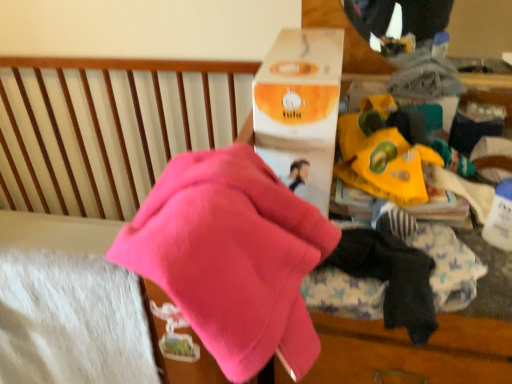
Question: From a real-world perspective, is dark blue cotton socks at lower right positioned under yellow paper bag at center based on gravity?

Choices:
 (A) no
 (B) yes

Answer: (B)

Question: Considering the relative sizes of dark blue cotton socks at lower right and yellow paper bag at center in the image provided, is dark blue cotton socks at lower right taller than yellow paper bag at center?

Choices:
 (A) yes
 (B) no

Answer: (A)

Question: Is yellow paper bag at center a part of dark blue cotton socks at lower right?

Choices:
 (A) yes
 (B) no

Answer: (B)

Question: Is dark blue cotton socks at lower right not inside yellow paper bag at center?

Choices:
 (A) yes
 (B) no

Answer: (A)

Question: From the image's perspective, is dark blue cotton socks at lower right beneath yellow paper bag at center?

Choices:
 (A) yes
 (B) no

Answer: (A)

Question: Is dark blue cotton socks at lower right positioned before yellow paper bag at center?

Choices:
 (A) no
 (B) yes

Answer: (B)

Question: Does pink fleece at center have a greater height compared to orange matte cardboard box at upper center?

Choices:
 (A) no
 (B) yes

Answer: (A)

Question: From a real-world perspective, is pink fleece at center over orange matte cardboard box at upper center?

Choices:
 (A) yes
 (B) no

Answer: (B)

Question: Can you confirm if pink fleece at center is positioned to the left of orange matte cardboard box at upper center?

Choices:
 (A) no
 (B) yes

Answer: (B)

Question: Would you say pink fleece at center is outside orange matte cardboard box at upper center?

Choices:
 (A) yes
 (B) no

Answer: (A)

Question: Is pink fleece at center positioned with its back to orange matte cardboard box at upper center?

Choices:
 (A) no
 (B) yes

Answer: (B)

Question: Does pink fleece at center touch orange matte cardboard box at upper center?

Choices:
 (A) yes
 (B) no

Answer: (B)

Question: Can you confirm if orange matte cardboard box at upper center is bigger than yellow paper bag at center?

Choices:
 (A) yes
 (B) no

Answer: (A)